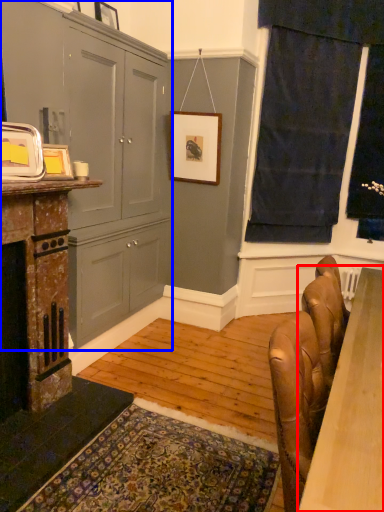
Question: Which object appears closest to the camera in this image, table (highlighted by a red box) or cabinetry (highlighted by a blue box)?

Choices:
 (A) table
 (B) cabinetry

Answer: (A)